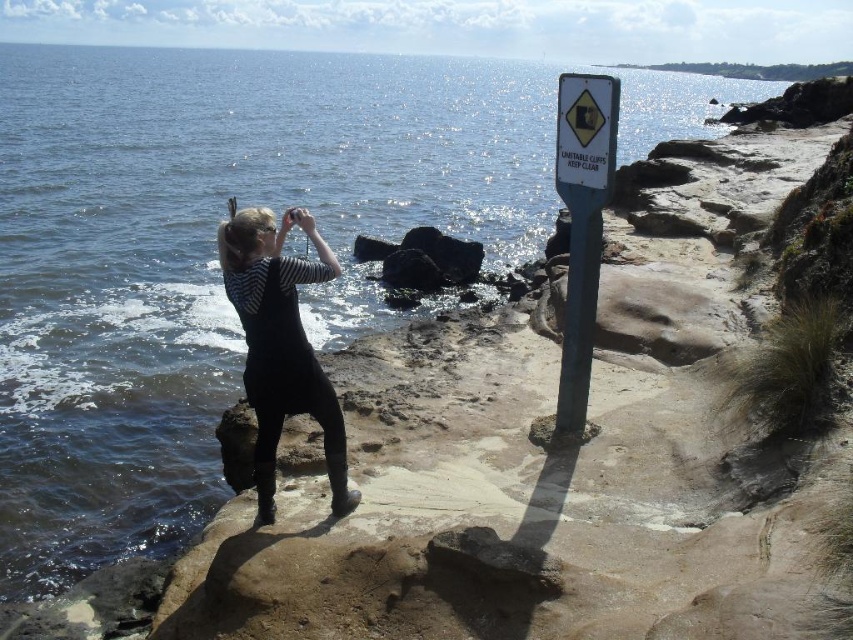
You are a hiker who wants to read the blue plastic sign at right but is currently standing near the black matte wetsuit at center. Which direction should you move to reach the sign?

The blue plastic sign at right is to the right of the black matte wetsuit at center, so you should move to your right to reach the sign.